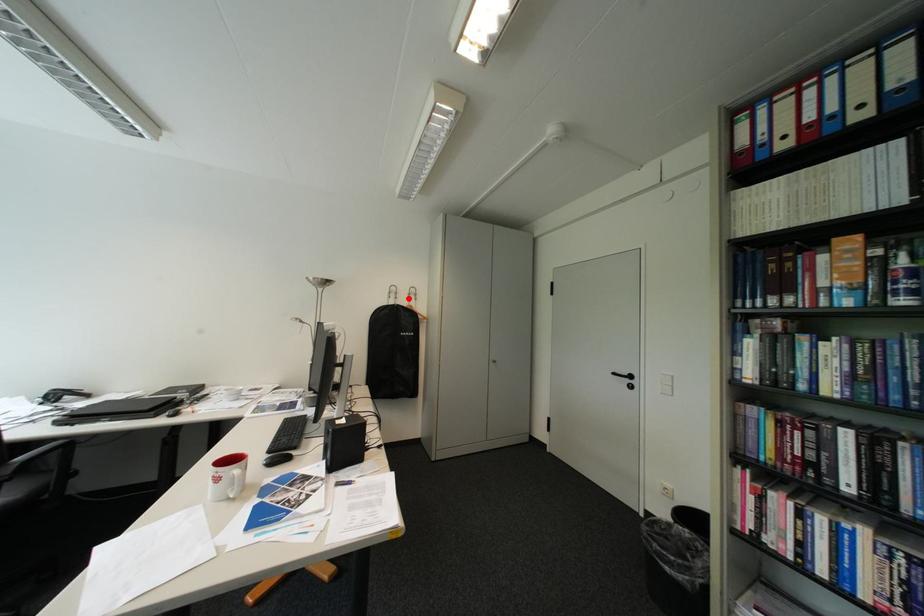
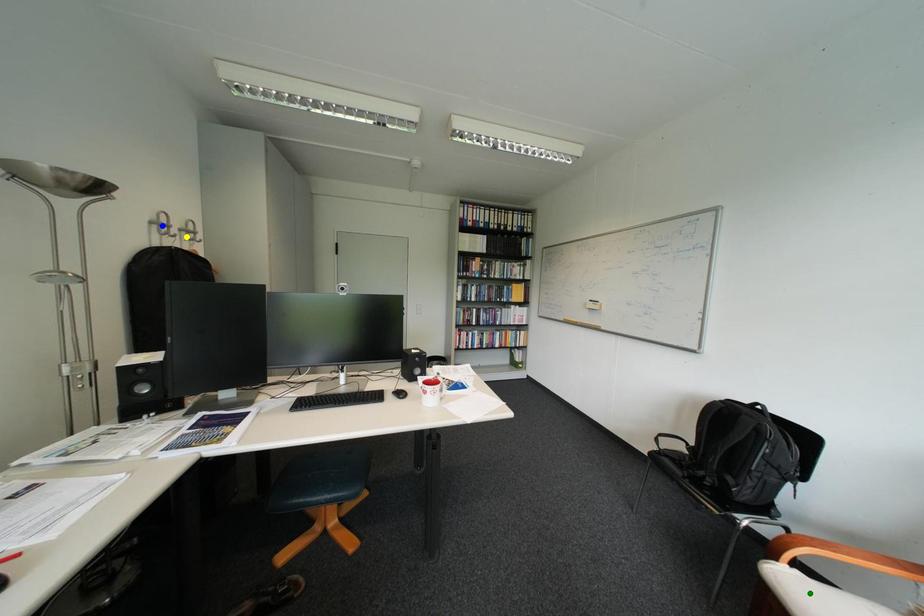
Question: I am providing you with two images of the same scene from different viewpoints. A red point is marked on the first image. You are given multiple points on the second image. Which point in image 2 represents the same 3d spot as the red point in image 1?

Choices:
 (A) blue point
 (B) green point
 (C) yellow point

Answer: (C)